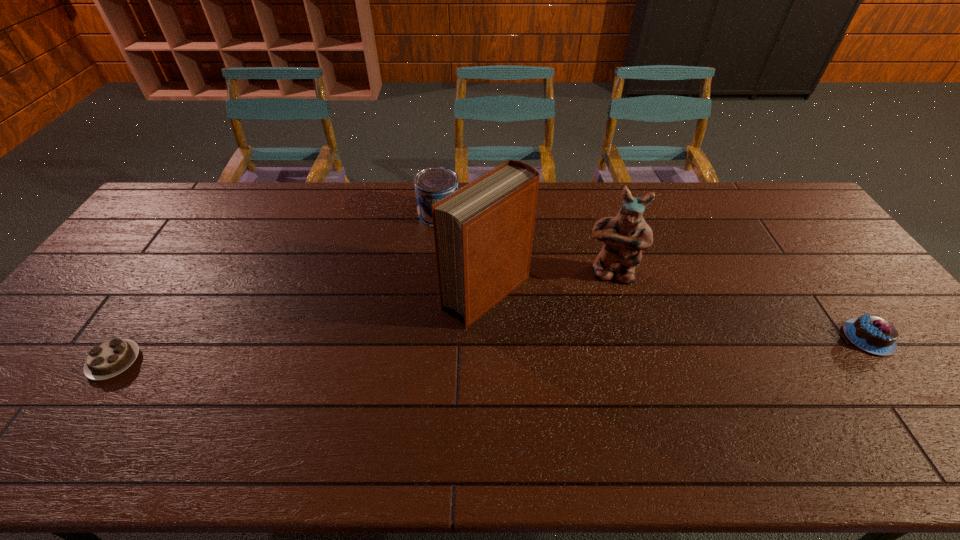
The image size is (960, 540). Find the location of `object at the far edge`. object at the far edge is located at coordinates coord(431,184).

I want to click on object located in the near edge section of the desktop, so click(111, 358).

Image resolution: width=960 pixels, height=540 pixels. In order to click on object that is positioned at the left edge in this screenshot , I will do point(111,358).

Where is `object located at the right edge`? The width and height of the screenshot is (960, 540). object located at the right edge is located at coordinates click(873, 334).

At what (x,y) coordinates should I click in order to perform the action: click on object at the near left corner. Please return your answer as a coordinate pair (x, y). Looking at the image, I should click on (111, 358).

In the image, there is a desktop. Identify the location of vacant area at the far edge. (741, 208).

The height and width of the screenshot is (540, 960). Find the location of `free point at the near edge`. free point at the near edge is located at coordinates (687, 413).

The image size is (960, 540). Identify the location of blank space at the left edge. (72, 330).

Locate an element on the screen. vacant space at the far right corner is located at coordinates (765, 213).

Locate an element on the screen. The height and width of the screenshot is (540, 960). vacant point at the near right corner is located at coordinates (941, 394).